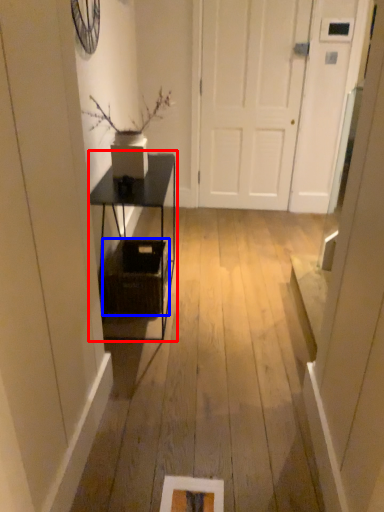
Question: Which point is further to the camera, table (highlighted by a red box) or basket (highlighted by a blue box)?

Choices:
 (A) table
 (B) basket

Answer: (B)